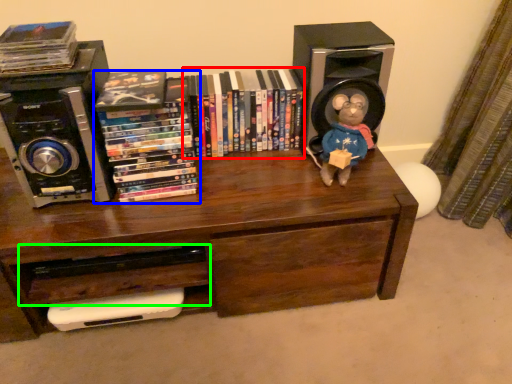
Question: Considering the real-world distances, which object is closest to book (highlighted by a red box)? book (highlighted by a blue box) or drawer (highlighted by a green box).

Choices:
 (A) book
 (B) drawer

Answer: (A)